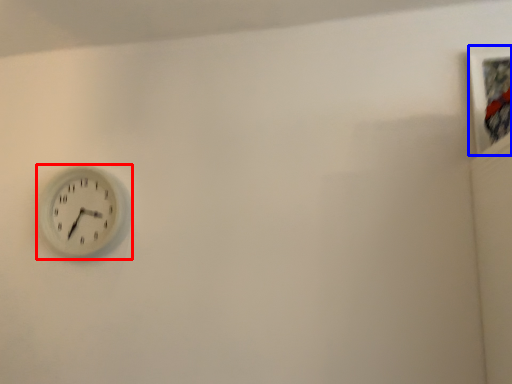
Question: Among these objects, which one is nearest to the camera, wall clock (highlighted by a red box) or picture frame (highlighted by a blue box)?

Choices:
 (A) wall clock
 (B) picture frame

Answer: (B)